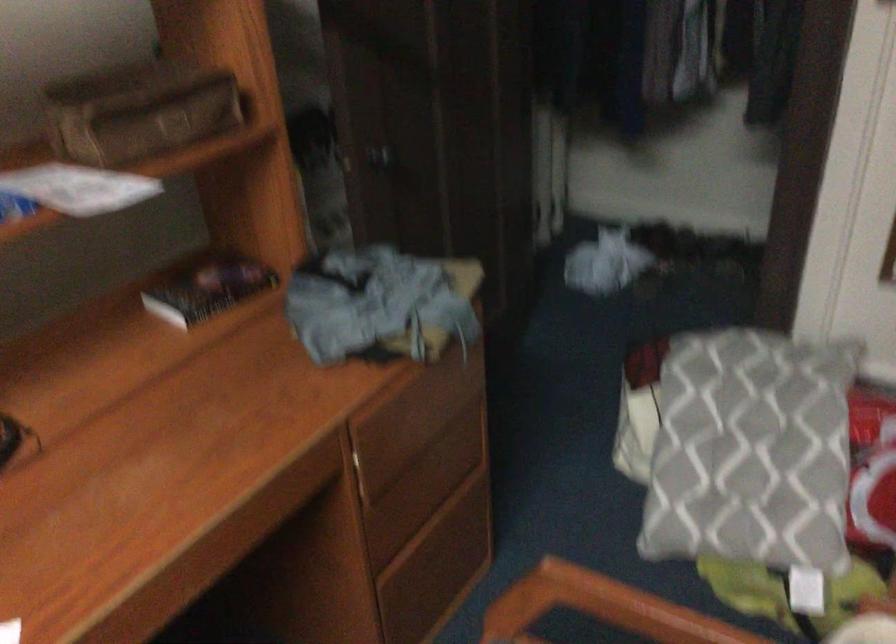
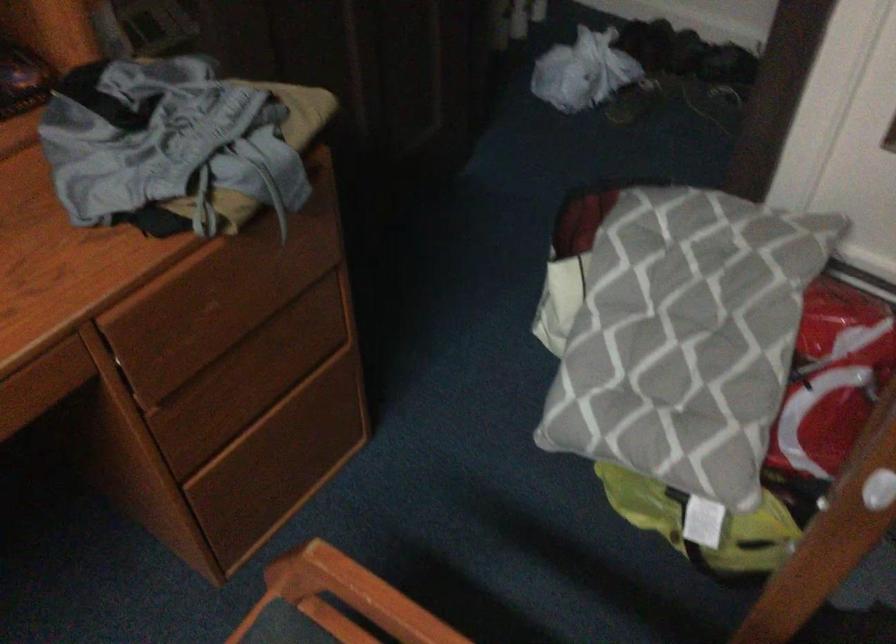
Question: The first image is from the beginning of the video and the second image is from the end. How did the camera likely rotate when shooting the video?

Choices:
 (A) Left
 (B) Right
 (C) Up
 (D) Down

Answer: (D)